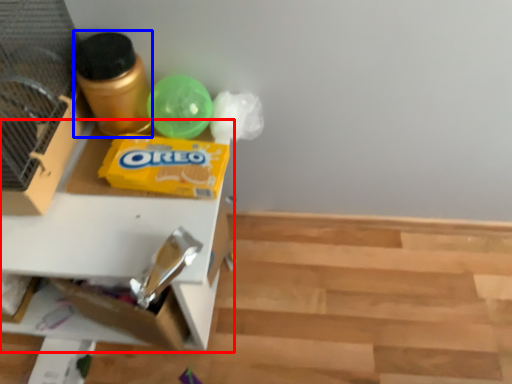
Question: Which of the following is the closest to the observer, table (highlighted by a red box) or bottle (highlighted by a blue box)?

Choices:
 (A) table
 (B) bottle

Answer: (A)